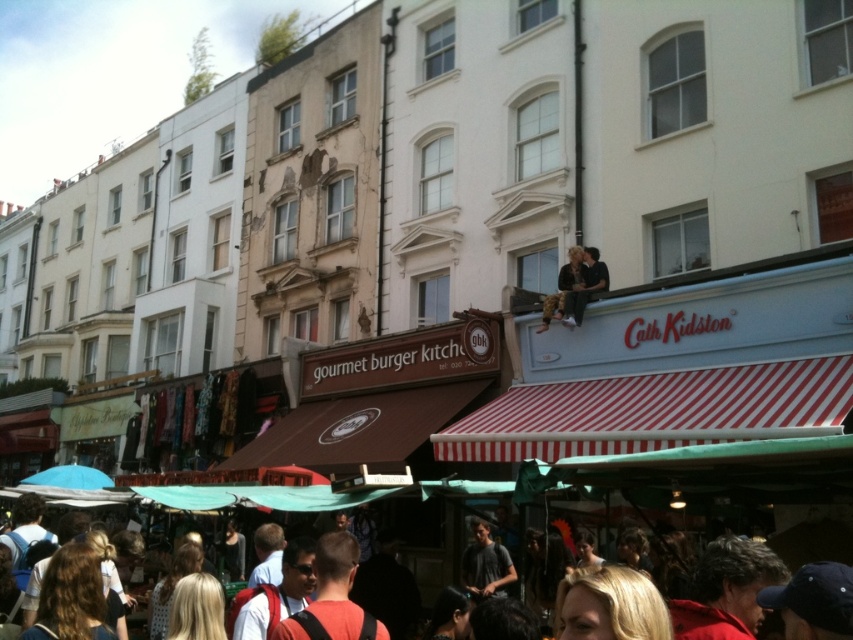
Question: Which point is closer to the camera?

Choices:
 (A) click(581, 276)
 (B) click(566, 307)
 (C) click(376, 627)
 (D) click(492, 561)

Answer: (C)

Question: Is orange fabric backpack at lower center above dark gray t-shirt at center?

Choices:
 (A) no
 (B) yes

Answer: (B)

Question: Can you confirm if orange fabric backpack at lower center is positioned to the right of brown leather jacket at upper center?

Choices:
 (A) yes
 (B) no

Answer: (B)

Question: Which object appears closest to the camera in this image?

Choices:
 (A) dark gray t-shirt at center
 (B) blonde hair at lower center
 (C) brown leather jacket at upper center

Answer: (B)

Question: Which of the following is the farthest from the observer?

Choices:
 (A) (469, 545)
 (B) (553, 305)
 (C) (341, 499)
 (D) (292, 620)

Answer: (B)

Question: Does dark gray t-shirt at center lie behind camouflage pants at upper center?

Choices:
 (A) yes
 (B) no

Answer: (B)